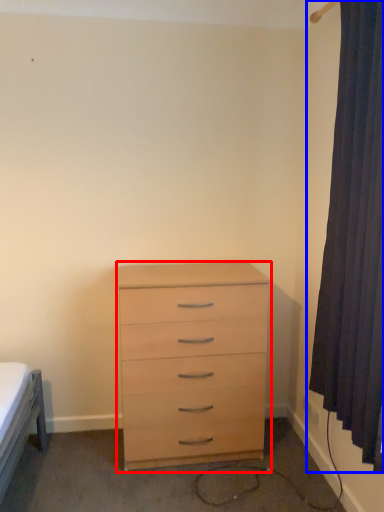
Question: Which object appears closest to the camera in this image, chest of drawers (highlighted by a red box) or curtain (highlighted by a blue box)?

Choices:
 (A) chest of drawers
 (B) curtain

Answer: (B)